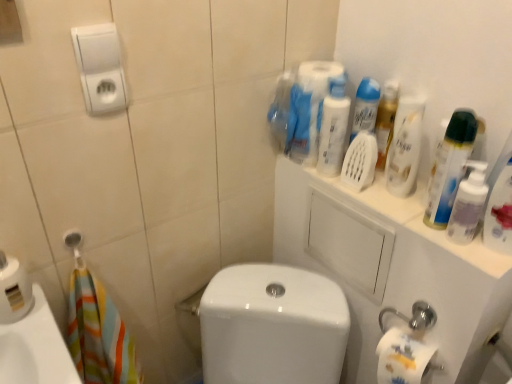
What are the coordinates of `vacant area situated to the left side of translucent plastic bottle at upper right, the 2th cleaning product positioned from the right` in the screenshot? It's located at (387, 212).